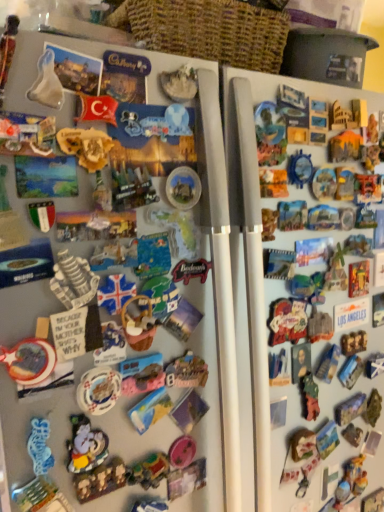
Question: Is wooden toy horse at lower right, acting as the tenth toy starting from the front, a part of translucent plastic toy at center, placed as the sixth toy when sorted from left to right?

Choices:
 (A) no
 (B) yes

Answer: (A)

Question: Does translucent plastic toy at center, which is the sixth toy from bottom to top, have a greater width compared to wooden toy horse at lower right, which is the 10th toy from left to right?

Choices:
 (A) yes
 (B) no

Answer: (A)

Question: Considering the relative sizes of translucent plastic toy at center, placed as the sixth toy when sorted from left to right, and wooden toy horse at lower right, acting as the tenth toy starting from the front, in the image provided, is translucent plastic toy at center, placed as the sixth toy when sorted from left to right, thinner than wooden toy horse at lower right, acting as the tenth toy starting from the front,?

Choices:
 (A) no
 (B) yes

Answer: (A)

Question: Is translucent plastic toy at center, which is the 7th toy from front to back, far from wooden toy horse at lower right, the 1th toy viewed from the right?

Choices:
 (A) yes
 (B) no

Answer: (B)

Question: Can we say translucent plastic toy at center, placed as the 4th toy when sorted from back to front, lies outside wooden toy horse at lower right, the 1th toy viewed from the right?

Choices:
 (A) yes
 (B) no

Answer: (A)

Question: From the image's perspective, does translucent plastic toy at center, the fifth toy from the right, appear higher than wooden toy horse at lower right, acting as the tenth toy starting from the front?

Choices:
 (A) no
 (B) yes

Answer: (B)

Question: Is woven brown basket at upper center oriented towards translucent plastic toy at center, the fifth toy from the right?

Choices:
 (A) yes
 (B) no

Answer: (B)

Question: Does woven brown basket at upper center have a lesser width compared to translucent plastic toy at center, placed as the sixth toy when sorted from left to right?

Choices:
 (A) yes
 (B) no

Answer: (B)

Question: Is woven brown basket at upper center looking in the opposite direction of translucent plastic toy at center, which is the 7th toy from front to back?

Choices:
 (A) no
 (B) yes

Answer: (A)

Question: From the image's perspective, is woven brown basket at upper center on translucent plastic toy at center, which ranks as the fifth toy in top-to-bottom order?

Choices:
 (A) no
 (B) yes

Answer: (B)

Question: Would you say woven brown basket at upper center is a long distance from translucent plastic toy at center, placed as the 4th toy when sorted from back to front?

Choices:
 (A) yes
 (B) no

Answer: (B)

Question: Can you confirm if woven brown basket at upper center is bigger than translucent plastic toy at center, placed as the sixth toy when sorted from left to right?

Choices:
 (A) yes
 (B) no

Answer: (A)

Question: Considering the relative sizes of translucent plastic toy at center, placed as the 4th toy when sorted from back to front, and green matte toy at right, which appears as the 9th toy when viewed from the front, in the image provided, is translucent plastic toy at center, placed as the 4th toy when sorted from back to front, bigger than green matte toy at right, which appears as the 9th toy when viewed from the front,?

Choices:
 (A) yes
 (B) no

Answer: (B)